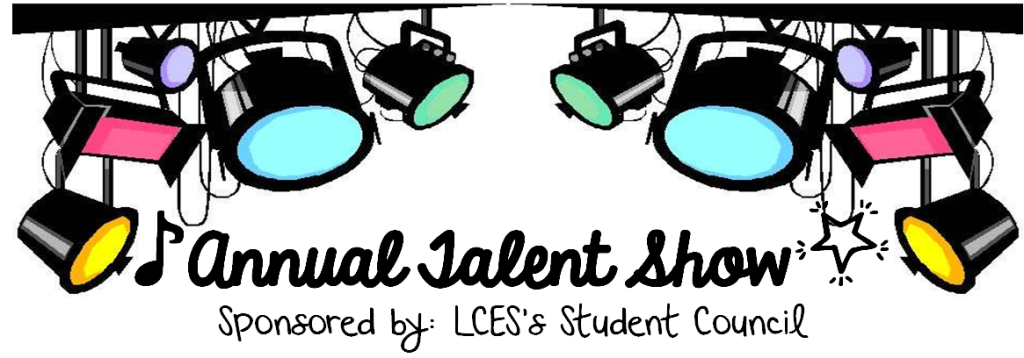
Where is `purple light`? purple light is located at coordinates (846, 68).